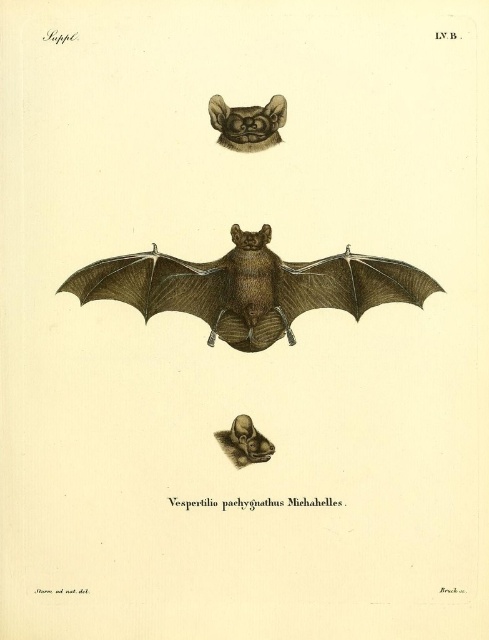
Question: Which of the following is the farthest from the observer?

Choices:
 (A) brown fur bat at upper center
 (B) brown textured bat at center

Answer: (A)

Question: From the image, what is the correct spatial relationship of brown textured bat at center in relation to brown fur bat at upper center?

Choices:
 (A) right
 (B) left

Answer: (A)

Question: Is brown textured bat at center further to the viewer compared to brown fur bat at upper center?

Choices:
 (A) no
 (B) yes

Answer: (A)

Question: Does brown textured bat at center have a smaller size compared to brown fur bat at upper center?

Choices:
 (A) no
 (B) yes

Answer: (A)

Question: Which point is closer to the camera?

Choices:
 (A) brown fur bat at upper center
 (B) brown textured bat at center

Answer: (B)